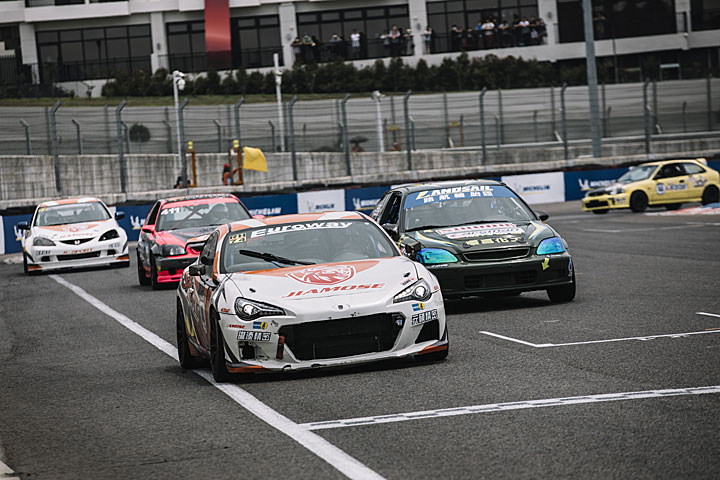
Identify the location of hood. This screenshot has height=480, width=720. (70, 229), (191, 234), (327, 284), (485, 232), (618, 182).